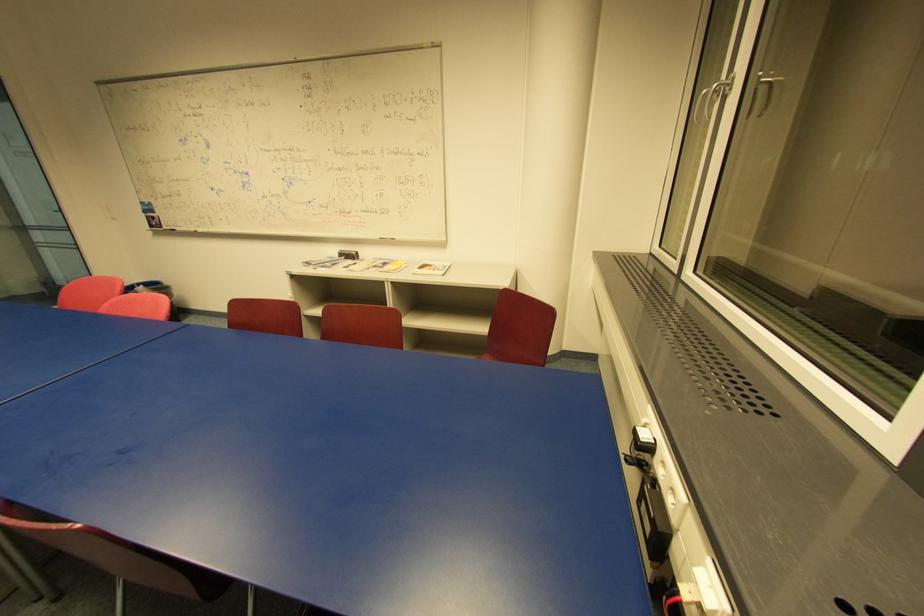
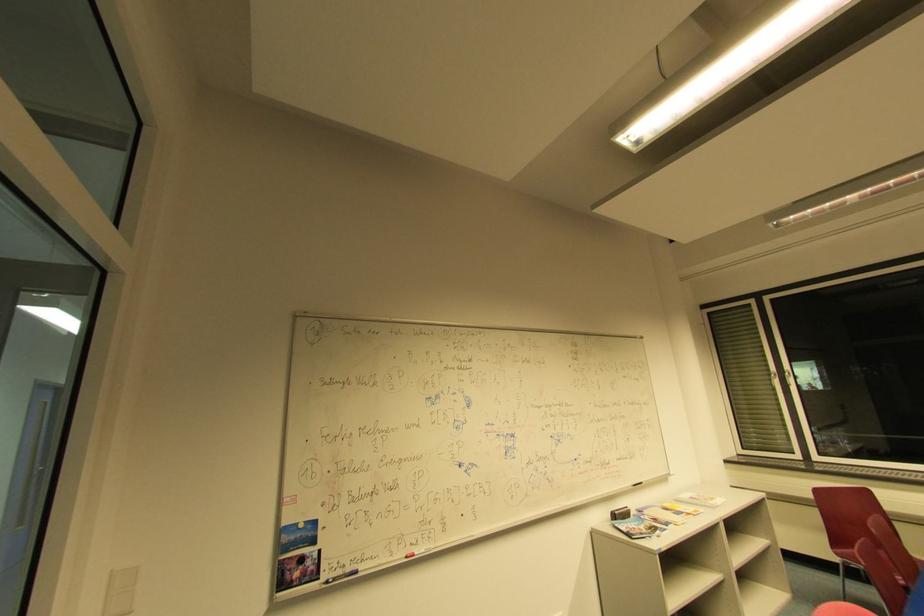
In the second image, find the point that corresponds to (x=379, y=268) in the first image.

(679, 515)